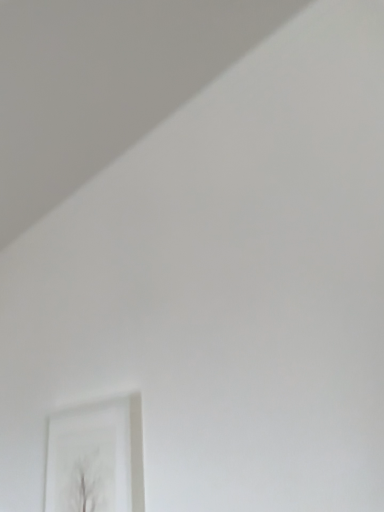
What is the approximate width of white matte picture frame at lower left?

white matte picture frame at lower left is 2.01 inches in width.

The height and width of the screenshot is (512, 384). Describe the element at coordinates (96, 458) in the screenshot. I see `white matte picture frame at lower left` at that location.

I want to click on white matte picture frame at lower left, so click(96, 458).

Where is `white matte picture frame at lower left`? This screenshot has width=384, height=512. white matte picture frame at lower left is located at coordinates (96, 458).